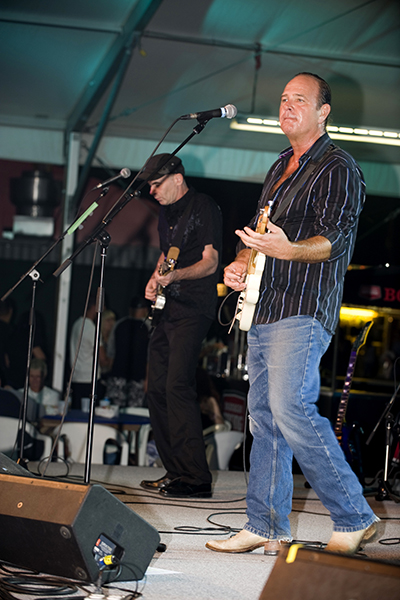
Locate an element on the screen. This screenshot has width=400, height=600. floor is located at coordinates (201, 594).